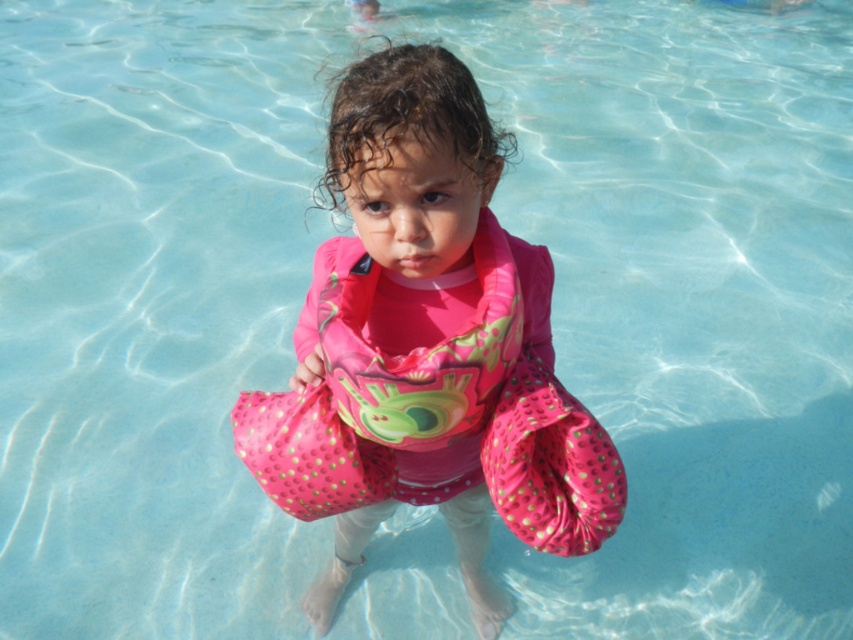
Question: Which point is closer to the camera?

Choices:
 (A) pink fabric life jacket at center
 (B) pink fabric floaties at center

Answer: (B)

Question: Is pink fabric floaties at center further to the viewer compared to pink fabric life jacket at center?

Choices:
 (A) yes
 (B) no

Answer: (B)

Question: Among these points, which one is nearest to the camera?

Choices:
 (A) (477, 436)
 (B) (505, 312)

Answer: (B)

Question: Is pink fabric floaties at center to the left of pink fabric life jacket at center from the viewer's perspective?

Choices:
 (A) no
 (B) yes

Answer: (A)

Question: Can you confirm if pink fabric floaties at center is positioned above pink fabric life jacket at center?

Choices:
 (A) yes
 (B) no

Answer: (B)